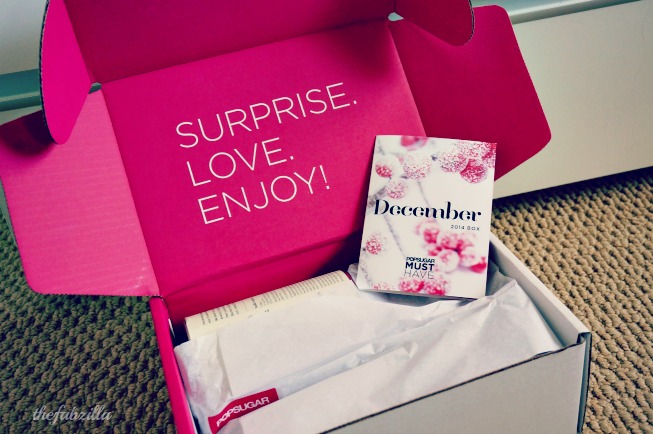
At what (x,y) coordinates should I click in order to perform the action: click on carpet. Please return your answer as a coordinate pair (x, y). Looking at the image, I should click on (597, 255).